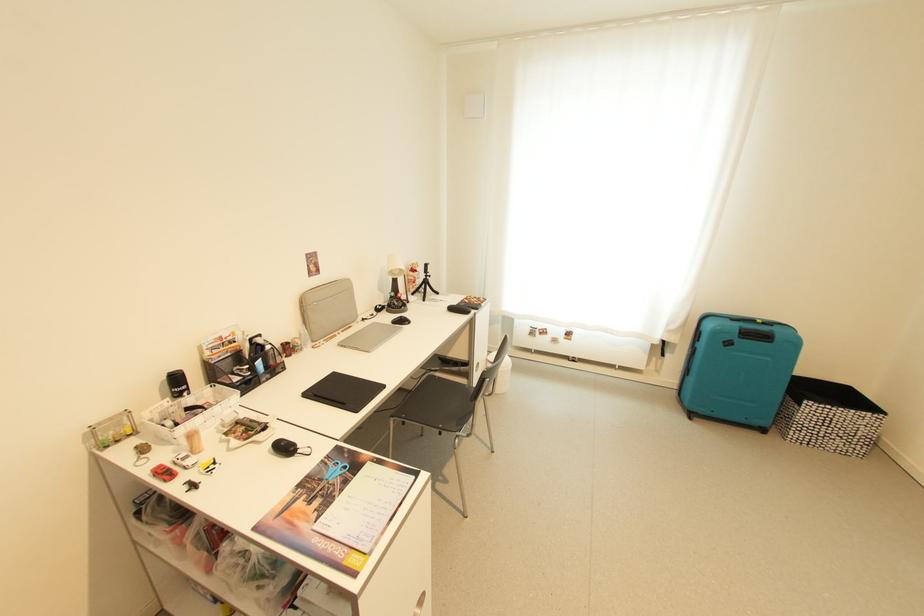
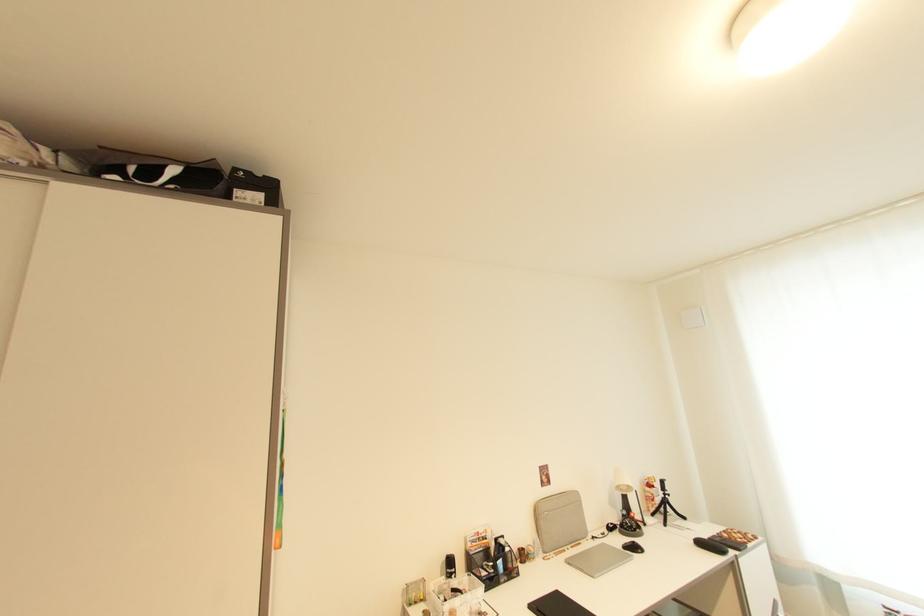
Locate, in the second image, the point that corresponds to point 338,375 in the first image.

(562, 594)